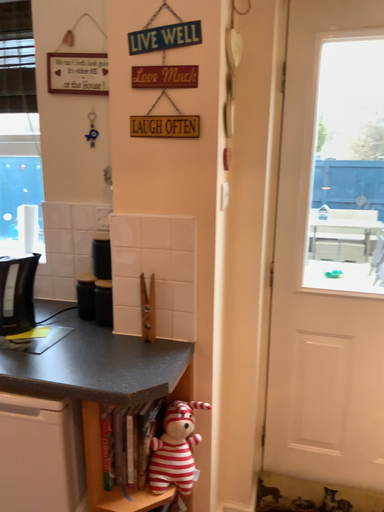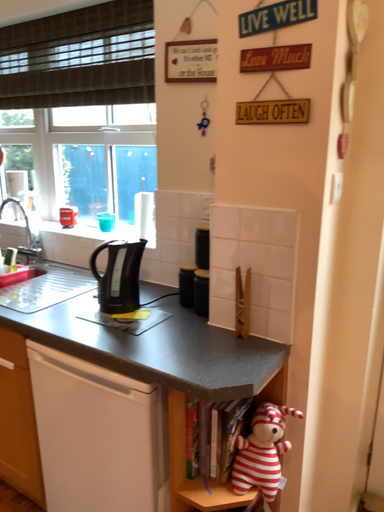
Question: Which way did the camera rotate in the video?

Choices:
 (A) rotated left
 (B) rotated right

Answer: (A)